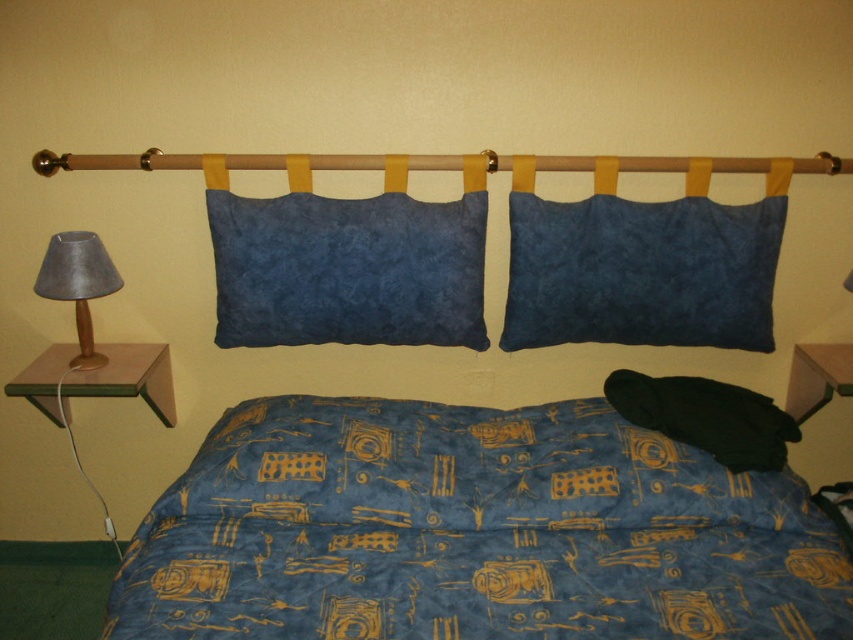
You are a delivery person who needs to place a small package between the blue printed fabric quilt at center and the suede blue pillow at center. Can you fit it there?

The distance between the blue printed fabric quilt at center and the suede blue pillow at center is 19.14 inches. Since the package is small, it should fit comfortably within this space.

You are standing in the bedroom and want to place a new decorative item between the blue printed fabric quilt at center and the dark blue suede pillow at upper center. Based on their positions, which object should the new item be closer to?

The new decorative item should be placed closer to the dark blue suede pillow at upper center because the blue printed fabric quilt at center is to the left of it, meaning the pillow is further to the right.

You are organizing a charity event and need to determine which item takes up more space between the blue printed fabric quilt at center and the dark blue suede pillow at upper center. Which one requires more storage space?

The blue printed fabric quilt at center is bigger than the dark blue suede pillow at upper center, so it requires more storage space.